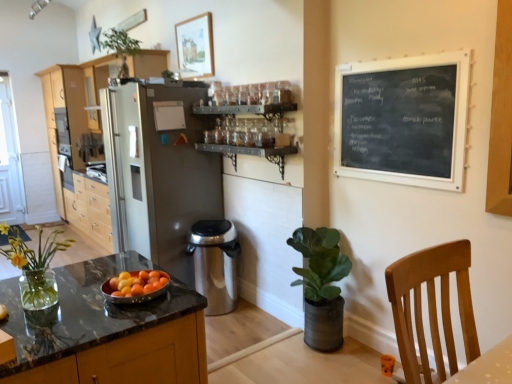
Question: Does light brown wood cabinets at left appear on the right side of marble countertop at lower left?

Choices:
 (A) yes
 (B) no

Answer: (B)

Question: Is there a large distance between light brown wood cabinets at left and marble countertop at lower left?

Choices:
 (A) no
 (B) yes

Answer: (B)

Question: From a real-world perspective, is light brown wood cabinets at left beneath marble countertop at lower left?

Choices:
 (A) no
 (B) yes

Answer: (A)

Question: Does light brown wood cabinets at left have a greater width compared to marble countertop at lower left?

Choices:
 (A) no
 (B) yes

Answer: (A)

Question: Considering the relative sizes of light brown wood cabinets at left and marble countertop at lower left in the image provided, is light brown wood cabinets at left bigger than marble countertop at lower left?

Choices:
 (A) no
 (B) yes

Answer: (B)

Question: Which is correct: clear glass vase at lower left, which appears as the 2th houseplant when ordered from the bottom, is inside silver metallic trash can at center, or outside of it?

Choices:
 (A) outside
 (B) inside

Answer: (A)

Question: From a real-world perspective, is clear glass vase at lower left, the 3th houseplant from the back, above or below silver metallic trash can at center?

Choices:
 (A) above
 (B) below

Answer: (A)

Question: Is clear glass vase at lower left, the second houseplant in the right-to-left sequence, to the left or to the right of silver metallic trash can at center in the image?

Choices:
 (A) left
 (B) right

Answer: (A)

Question: From the image's perspective, is clear glass vase at lower left, the second houseplant in the right-to-left sequence, positioned above or below silver metallic trash can at center?

Choices:
 (A) below
 (B) above

Answer: (B)

Question: Relative to green matte plant at lower right, arranged as the second houseplant when viewed from the back, is black chalkboard at upper right in front or behind?

Choices:
 (A) behind
 (B) front

Answer: (B)

Question: In terms of width, does black chalkboard at upper right look wider or thinner when compared to green matte plant at lower right, arranged as the second houseplant when viewed from the back?

Choices:
 (A) wide
 (B) thin

Answer: (B)

Question: Considering the positions of black chalkboard at upper right and green matte plant at lower right, positioned as the 1th houseplant in bottom-to-top order, in the image, is black chalkboard at upper right taller or shorter than green matte plant at lower right, positioned as the 1th houseplant in bottom-to-top order,?

Choices:
 (A) short
 (B) tall

Answer: (A)

Question: From a real-world perspective, is black chalkboard at upper right physically located above or below green matte plant at lower right, marked as the 3th houseplant in a left-to-right arrangement?

Choices:
 (A) below
 (B) above

Answer: (B)

Question: Is green leafy plant at upper center, placed as the 3th houseplant when sorted from right to left, in front of or behind satin silver refrigerator at center in the image?

Choices:
 (A) front
 (B) behind

Answer: (B)

Question: Considering the relative positions of green leafy plant at upper center, the 3th houseplant positioned from the bottom, and satin silver refrigerator at center in the image provided, is green leafy plant at upper center, the 3th houseplant positioned from the bottom, to the left or to the right of satin silver refrigerator at center?

Choices:
 (A) left
 (B) right

Answer: (A)